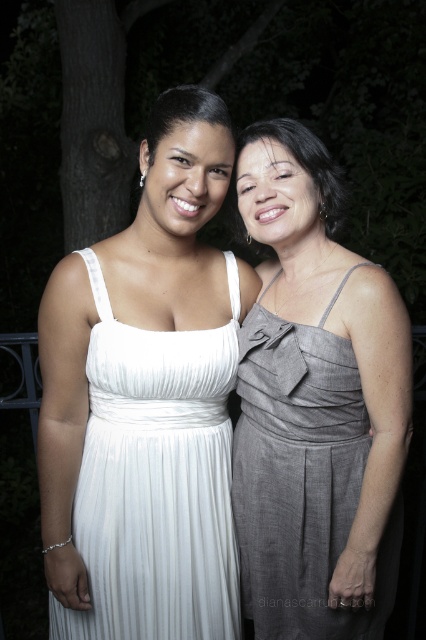
Question: Does white pleated dress at left appear on the right side of gray textured dress at center?

Choices:
 (A) yes
 (B) no

Answer: (B)

Question: Which point appears farthest from the camera in this image?

Choices:
 (A) (252, 364)
 (B) (109, 604)

Answer: (A)

Question: Does white pleated dress at left have a larger size compared to gray textured dress at center?

Choices:
 (A) no
 (B) yes

Answer: (B)

Question: Can you confirm if white pleated dress at left is smaller than gray textured dress at center?

Choices:
 (A) no
 (B) yes

Answer: (A)